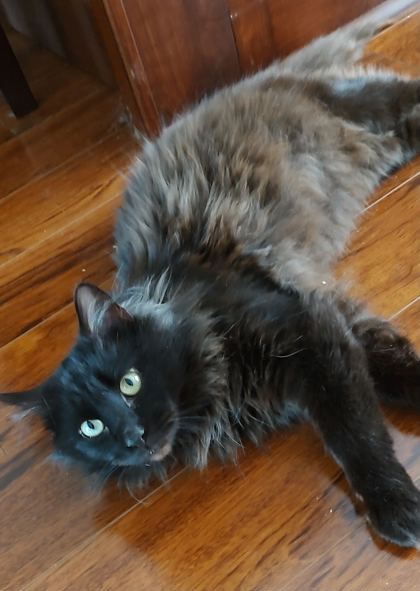
Locate an element on the screen. Image resolution: width=420 pixels, height=591 pixels. dividing crack between floor boards is located at coordinates (299, 574), (101, 529), (407, 305), (394, 190), (31, 327), (55, 233), (53, 165), (63, 113).